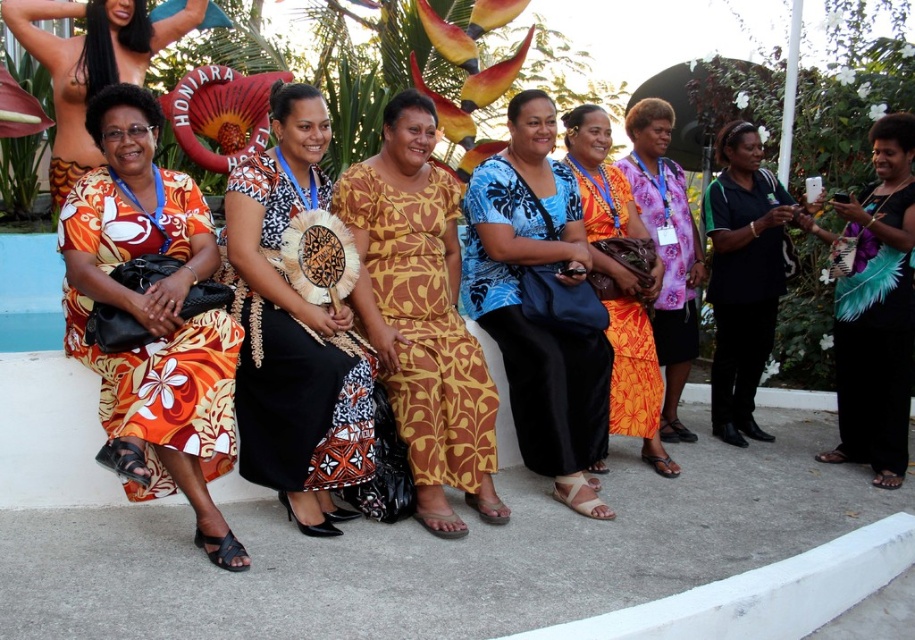
You are organizing a photo shoot and need to arrange the orange printed fabric dress at left and the matte black dress at center based on their sizes. Which dress should you place first if you want to start with the bigger one?

The orange printed fabric dress at left is larger in size than the matte black dress at center, so you should place the orange printed fabric dress at left first.

You are organizing a photo shoot and need to arrange two dresses in the frame. The teal feathered dress at right and the matte orange dress at center are both in the scene. Which dress should you adjust to make more room for the other?

The teal feathered dress at right occupies less space than the matte orange dress at center, so you should adjust the matte orange dress at center to make more room for the teal feathered dress at right.